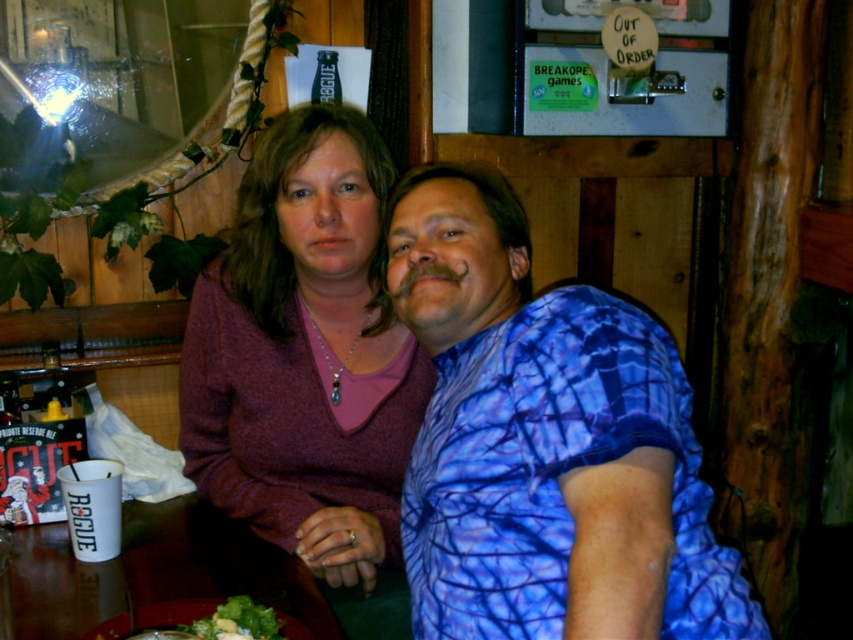
You are a server at the bar and need to place a new drink order on the table. Considering the wooden table at lower center and the green leafy salad at lower center, which one has a larger surface area to place the drink?

The wooden table at lower center has a larger surface area than the green leafy salad at lower center, so the drink can be placed on the table.